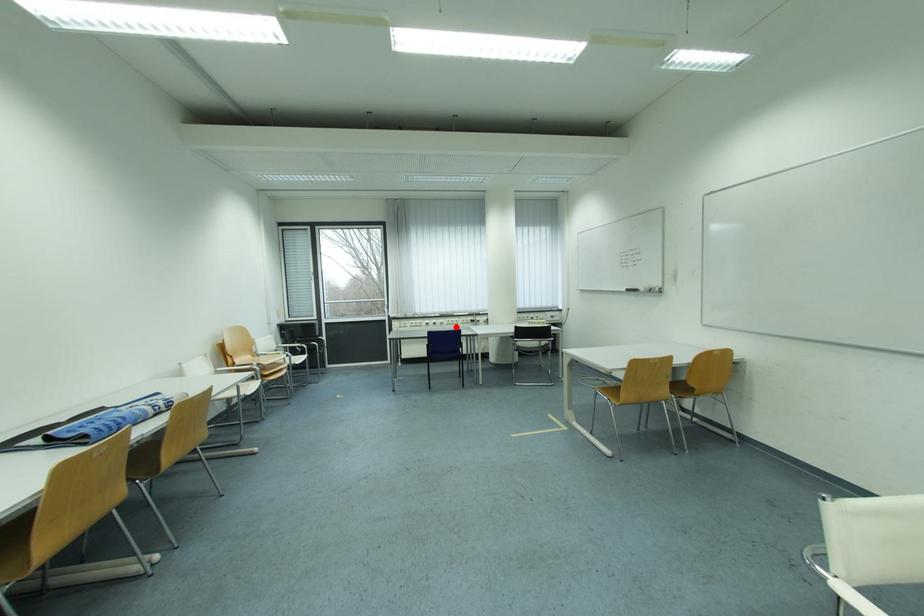
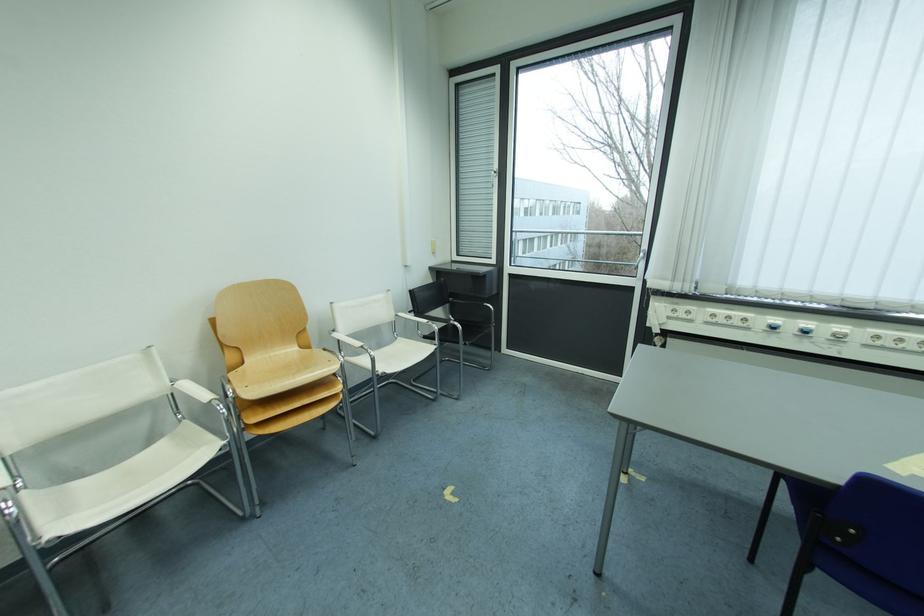
In the second image, find the point that corresponds to the highlighted location in the first image.

(874, 347)